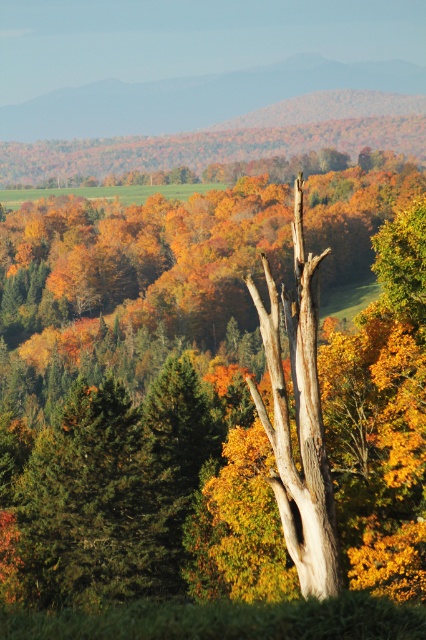
Which of these two, smooth bark tree at center or green matte tree at left, stands shorter?

green matte tree at left

Which is behind, point (385, 380) or point (126, 404)?

The point (126, 404) is behind.

Does point (360, 182) come farther from viewer compared to point (126, 518)?

Yes, it is.

I want to click on smooth bark tree at center, so click(141, 401).